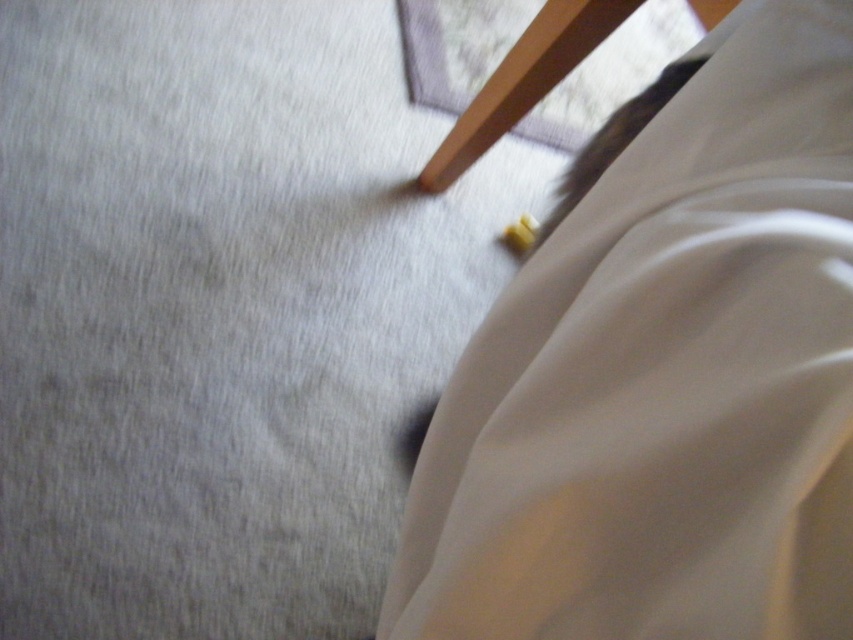
You are moving a beige satin sheet at lower right and a wooden chair at upper center into a storage room. The storage room has a narrow doorway that is 60 centimeters wide. Can both items be moved through the doorway side by side?

The beige satin sheet at lower right and wooden chair at upper center are 63.66 centimeters apart from each other. Since the doorway is only 60 centimeters wide, moving them side by side would not be possible as they require more space than available.

You are organizing a storage room and need to determine which item takes up more space between the beige satin sheet at lower right and the wooden chair at upper center. Which one requires more storage space?

The beige satin sheet at lower right is bigger than the wooden chair at upper center, so it requires more storage space.